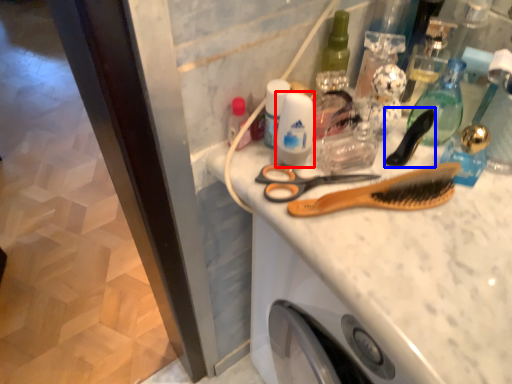
Question: Which point is closer to the camera, toiletry (highlighted by a red box) or brush (highlighted by a blue box)?

Choices:
 (A) toiletry
 (B) brush

Answer: (A)